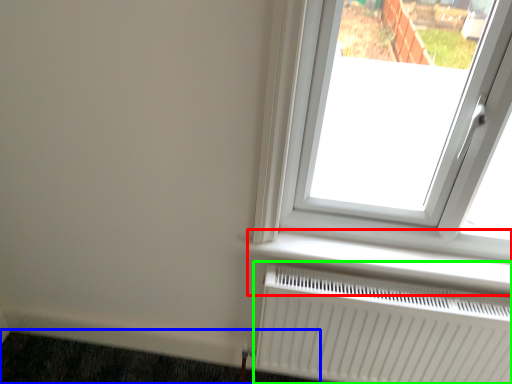
Question: Based on their relative distances, which object is nearer to window sill (highlighted by a red box)? Choose from doormat (highlighted by a blue box) and radiator (highlighted by a green box).

Choices:
 (A) doormat
 (B) radiator

Answer: (B)